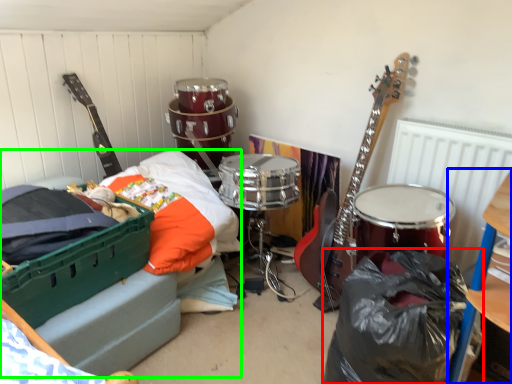
Question: Estimate the real-world distances between objects in this image. Which object is closer to garbage (highlighted by a red box), furniture (highlighted by a blue box) or bed (highlighted by a green box)?

Choices:
 (A) furniture
 (B) bed

Answer: (A)